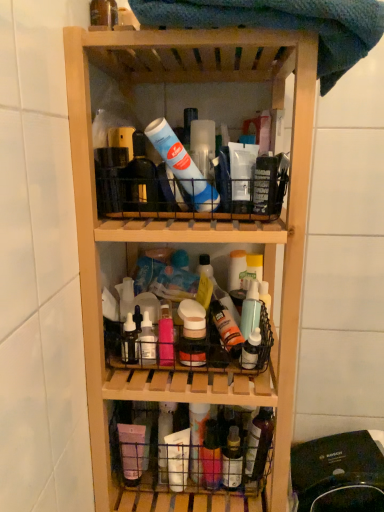
The width and height of the screenshot is (384, 512). I want to click on unoccupied region to the right of translucent plastic bottle at upper left, the first bottle from the top, so click(194, 54).